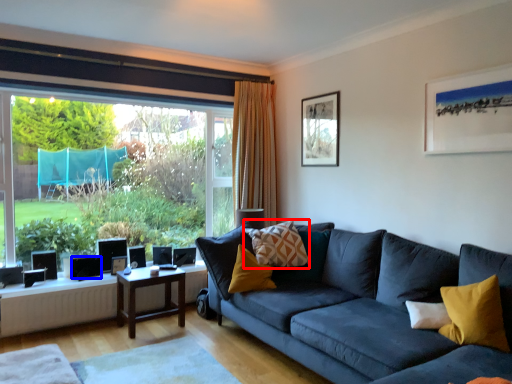
Question: Which object is further to the camera taking this photo, pillow (highlighted by a red box) or speaker (highlighted by a blue box)?

Choices:
 (A) pillow
 (B) speaker

Answer: (B)